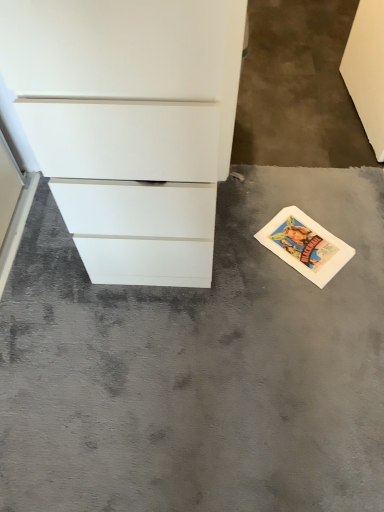
Identify the location of vacant area situated below white matte chest of drawers at left (from a real-world perspective). (158, 232).